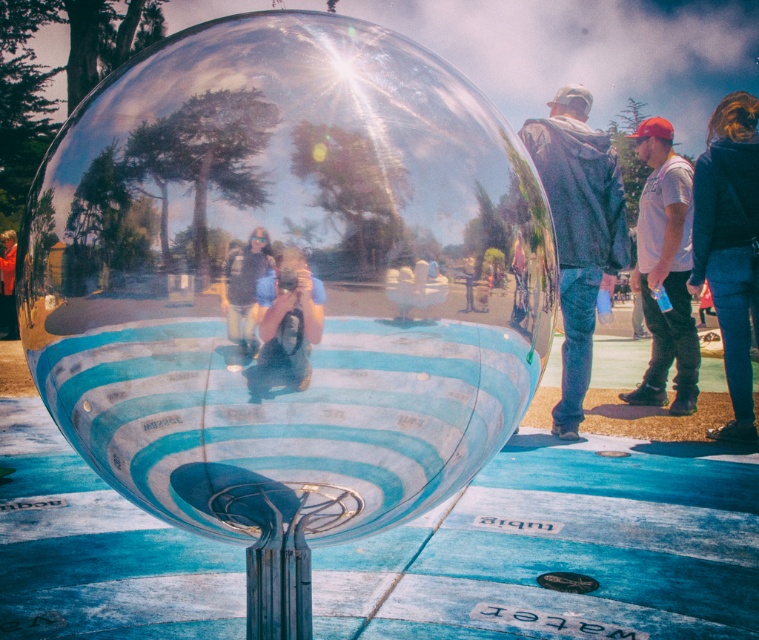
You are a photographer holding the blue fabric camera at center and want to take a photo of the dark gray jacket at right. Since the sphere distorts reflections, which object should you position closer to the sphere to ensure the jacket appears larger in the reflection?

The dark gray jacket at right should be positioned closer to the sphere because it has a greater height compared to the blue fabric camera at center, so moving it closer would enhance its reflection size.

You are standing in front of the spherical dome and notice two points marked on the ground. The first point is at coordinates point (731, 96) and the second is at point (654, 305). Which point is closer to you?

Point (731, 96) is closer to the camera than point (654, 305).

You are standing in front of the spherical dome and notice two items in the reflection. The dark blue jeans at lower right and the white cotton shirt at right. Which item appears lower in the reflection?

The dark blue jeans at lower right appears lower in the reflection than the white cotton shirt at right.